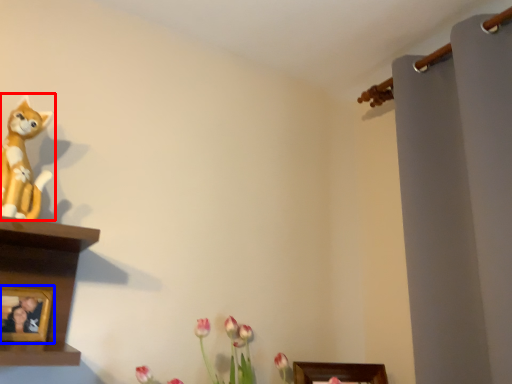
Question: Which object is further to the camera taking this photo, toy (highlighted by a red box) or picture frame (highlighted by a blue box)?

Choices:
 (A) toy
 (B) picture frame

Answer: (B)